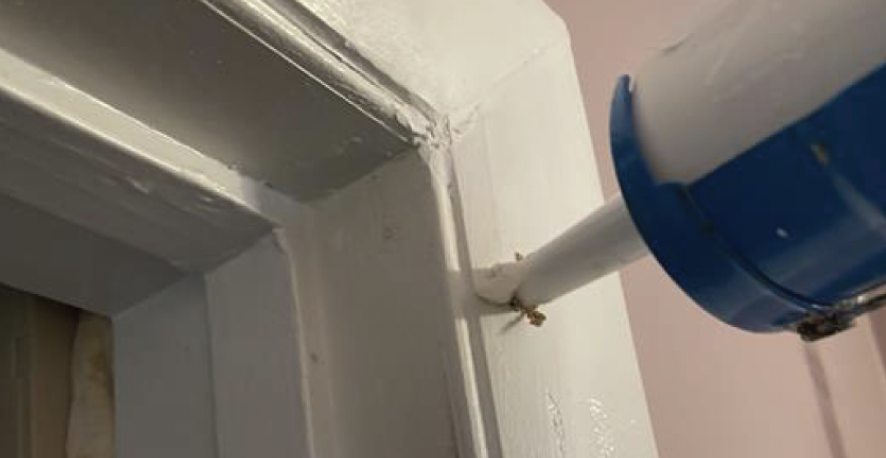
You are a GUI agent. You are given a task and a screenshot of the screen. Output one action in this format:
    pyautogui.click(x=<x>, y=<y>)
    Task: Click on the holder
    The height and width of the screenshot is (458, 886).
    Given the screenshot: What is the action you would take?
    pyautogui.click(x=820, y=184)